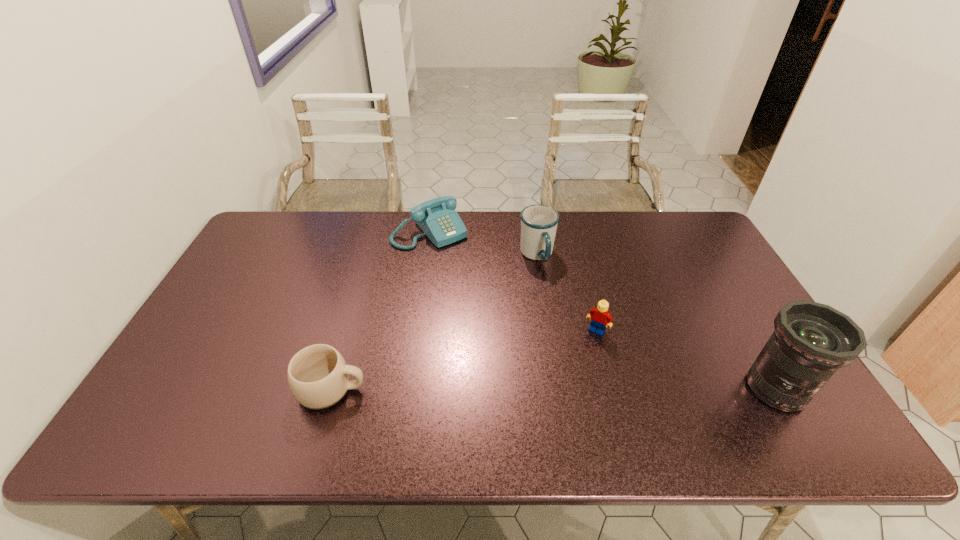
You are a GUI agent. You are given a task and a screenshot of the screen. Output one action in this format:
    pyautogui.click(x=<x>, y=<y>)
    Task: Click on the vacant space located 0.070m on the left of the rightmost object
    The height and width of the screenshot is (540, 960).
    Given the screenshot: What is the action you would take?
    pyautogui.click(x=714, y=389)

I want to click on vacant position located on the front-facing side of the Lego, so click(x=581, y=354).

I want to click on vacant space located on the front-facing side of the Lego, so [x=581, y=354].

The image size is (960, 540). I want to click on free point located on the front-facing side of the Lego, so click(x=572, y=369).

Identify the location of vacant region located 0.160m on the handle side of the right mug. (565, 306).

Locate an element on the screen. This screenshot has height=540, width=960. free space located 0.400m on the handle side of the right mug is located at coordinates (606, 372).

The image size is (960, 540). In order to click on vacant space situated on the handle side of the right mug in this screenshot , I will do `click(573, 318)`.

The image size is (960, 540). I want to click on vacant space situated on the dial of the telephone, so click(x=470, y=271).

At what (x,y) coordinates should I click in order to perform the action: click on vacant space situated 0.150m on the dial of the telephone. Please return your answer as a coordinate pair (x, y). Looking at the image, I should click on (472, 272).

What are the coordinates of `vacant space located on the dial of the telephone` in the screenshot? It's located at (494, 295).